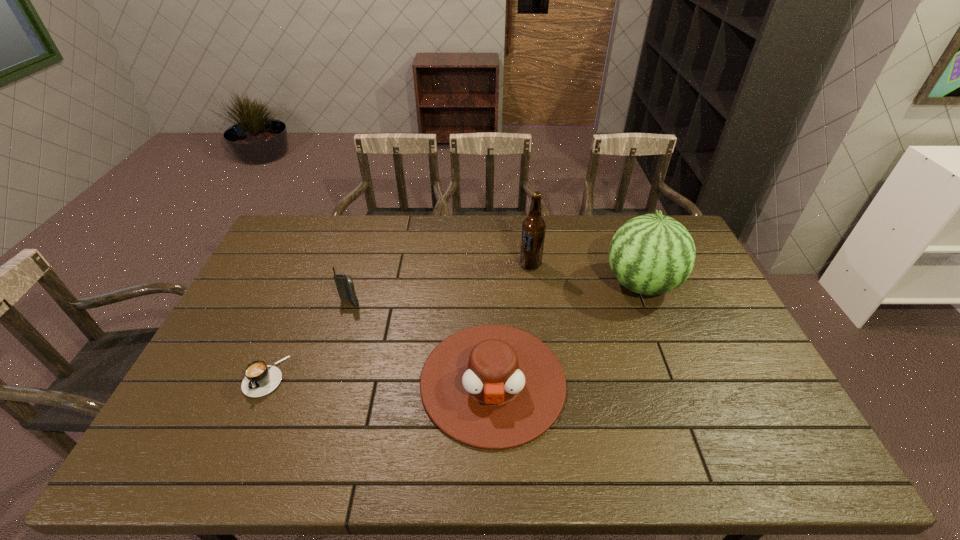
Locate which object ranks in proximity to the rightmost object. Please provide its 2D coordinates. Your answer should be formatted as a tuple, i.e. [(x, y)], where the tuple contains the x and y coordinates of a point satisfying the conditions above.

[(494, 387)]

Identify the location of object identified as the second closest to the beer bottle. The height and width of the screenshot is (540, 960). (494, 387).

I want to click on free space that satisfies the following two spatial constraints: 1. on the label of the beer bottle; 2. on the front-facing side of the cowboy hat, so (x=545, y=381).

You are a GUI agent. You are given a task and a screenshot of the screen. Output one action in this format:
    pyautogui.click(x=<x>, y=<y>)
    Task: Click on the free location that satisfies the following two spatial constraints: 1. on the label of the beer bottle; 2. on the keyboard of the third shortest object
    
    Given the screenshot: What is the action you would take?
    pyautogui.click(x=536, y=303)

The height and width of the screenshot is (540, 960). I want to click on blank area in the image that satisfies the following two spatial constraints: 1. on the label of the beer bottle; 2. with the handle on the side of the cappuccino, so click(x=544, y=376).